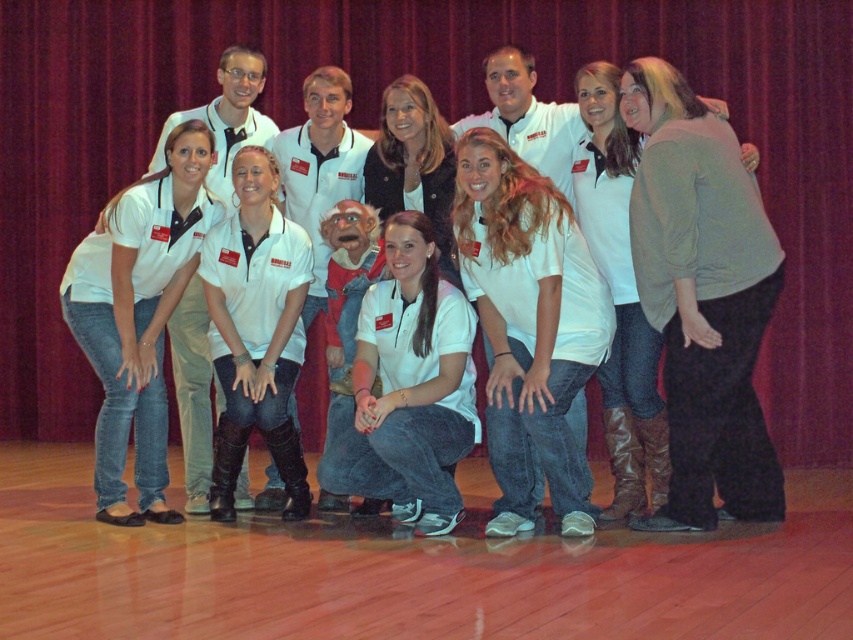
Question: Is green textured sweater at right thinner than white matte shirt at lower left?

Choices:
 (A) yes
 (B) no

Answer: (B)

Question: Does white cotton shirt at center appear under white matte shirt at lower left?

Choices:
 (A) no
 (B) yes

Answer: (B)

Question: Which object is positioned farthest from the white cotton shirt at center?

Choices:
 (A) velvet red curtain at upper center
 (B) white matte shirt at center

Answer: (A)

Question: Which object appears farthest from the camera in this image?

Choices:
 (A) white cotton shirt at center
 (B) white matte shirt at center
 (C) green textured sweater at right

Answer: (B)

Question: Can you confirm if white cotton shirt at center is smaller than white matte shirt at center?

Choices:
 (A) no
 (B) yes

Answer: (A)

Question: Among these points, which one is farthest from the camera?

Choices:
 (A) (190, 204)
 (B) (305, 481)
 (C) (553, 353)

Answer: (B)